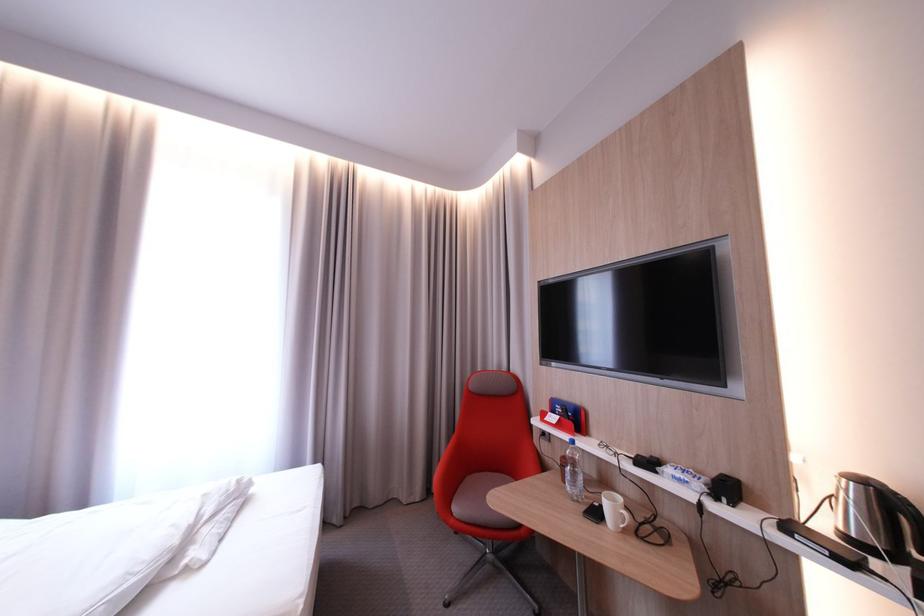
Locate an element on the screen. clear water bottle is located at coordinates (574, 472).